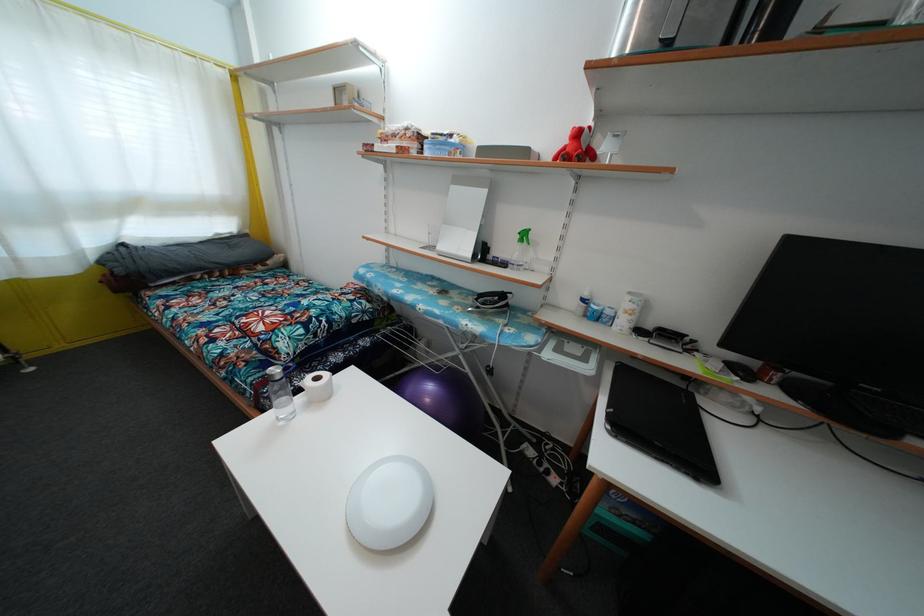
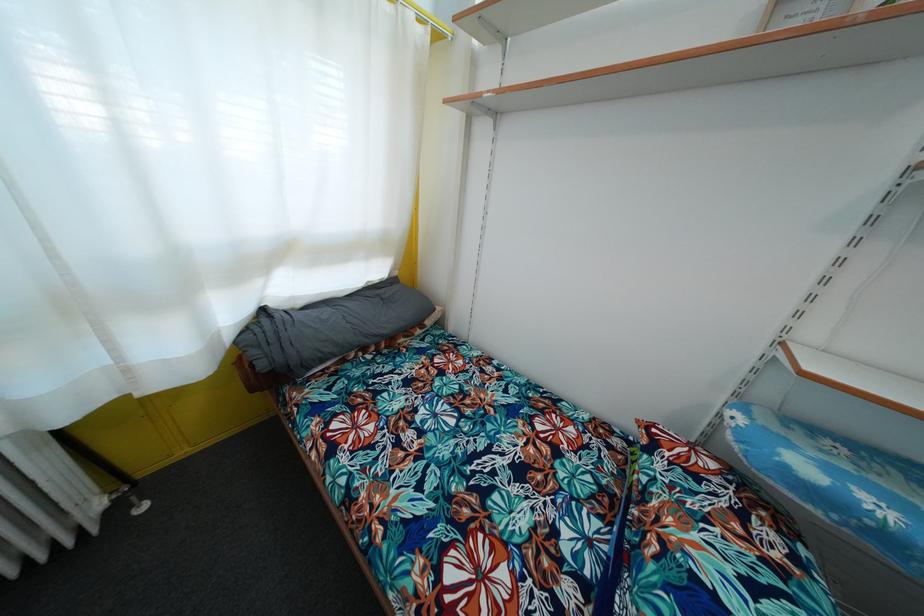
In a continuous first-person perspective shot, in which direction is the camera moving?

The movement direction of the cameraman is left, forward.